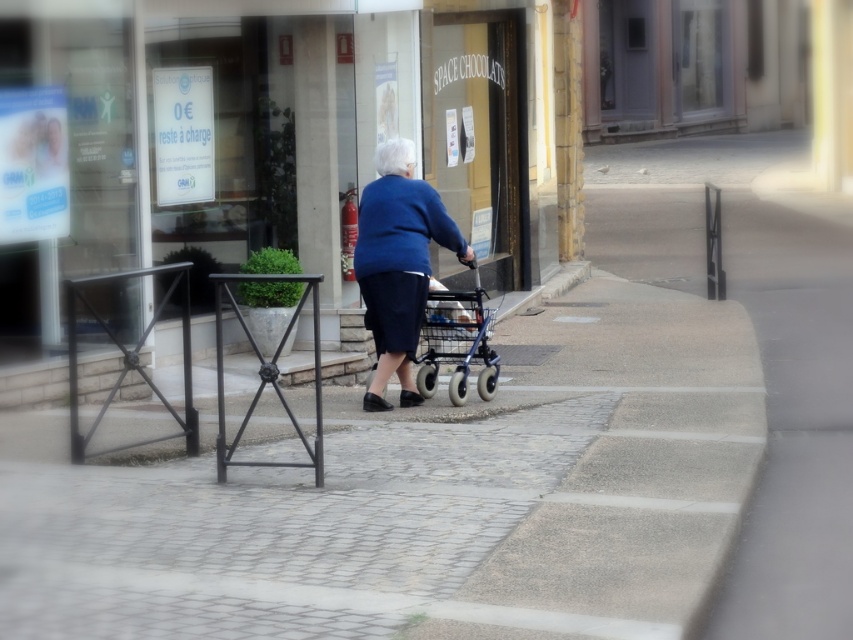
Which is above, gray concrete pavement at center or blue fabric walker at center?

blue fabric walker at center

Identify the location of gray concrete pavement at center. The width and height of the screenshot is (853, 640). (427, 502).

Can you confirm if blue fabric walker at center is shorter than metallic blue walker at center?

No, blue fabric walker at center is not shorter than metallic blue walker at center.

Consider the image. Can you confirm if blue fabric walker at center is positioned to the right of metallic blue walker at center?

Incorrect, blue fabric walker at center is not on the right side of metallic blue walker at center.

Which is behind, point (402, 241) or point (491, 352)?

Point (491, 352)

Where is `blue fabric walker at center`? This screenshot has width=853, height=640. blue fabric walker at center is located at coordinates (398, 262).

Can you confirm if gray concrete pavement at center is shorter than metallic blue walker at center?

Correct, gray concrete pavement at center is not as tall as metallic blue walker at center.

Does gray concrete pavement at center have a larger size compared to metallic blue walker at center?

Yes, gray concrete pavement at center is bigger than metallic blue walker at center.

What do you see at coordinates (427, 502) in the screenshot? The width and height of the screenshot is (853, 640). I see `gray concrete pavement at center` at bounding box center [427, 502].

At what (x,y) coordinates should I click in order to perform the action: click on gray concrete pavement at center. Please return your answer as a coordinate pair (x, y). The image size is (853, 640). Looking at the image, I should click on (427, 502).